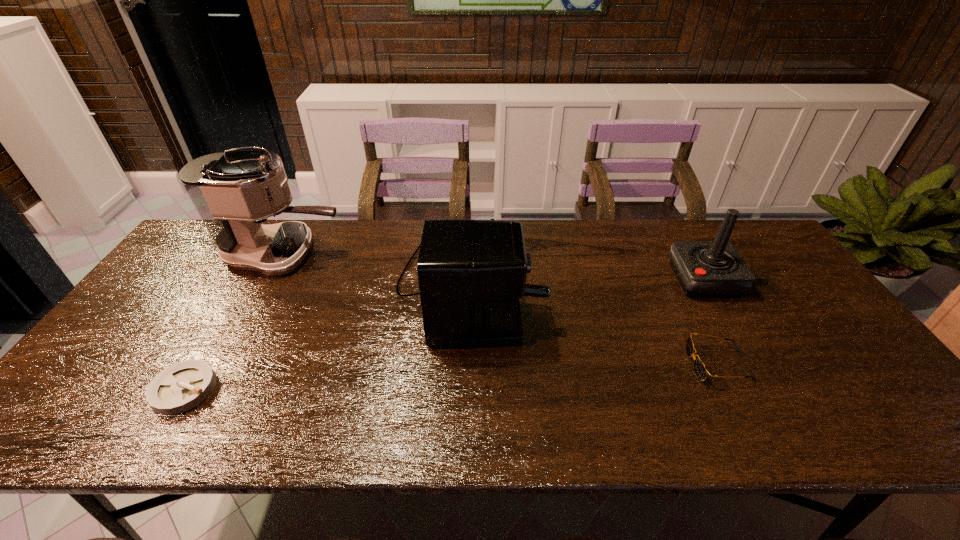
You are a GUI agent. You are given a task and a screenshot of the screen. Output one action in this format:
    pyautogui.click(x=<x>, y=<y>)
    Task: Click on the empty space that is in between the joystick and the third object from right to left
    
    Given the screenshot: What is the action you would take?
    pyautogui.click(x=587, y=282)

The image size is (960, 540). I want to click on vacant area that lies between the sunglasses and the joystick, so click(710, 322).

You are a GUI agent. You are given a task and a screenshot of the screen. Output one action in this format:
    pyautogui.click(x=<x>, y=<y>)
    Task: Click on the object that is the second closest to the ashtray
    The height and width of the screenshot is (540, 960).
    Given the screenshot: What is the action you would take?
    pyautogui.click(x=471, y=273)

Identify the location of the second closest object to the second shortest object. (471, 273).